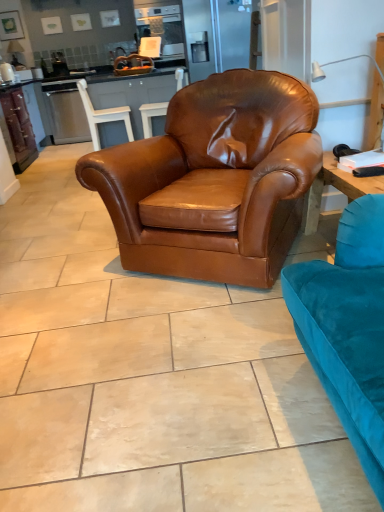
Identify the location of vacant space to the left of brown leather armchair at center, which ranks as the 1th chair in front-to-back order. (70, 259).